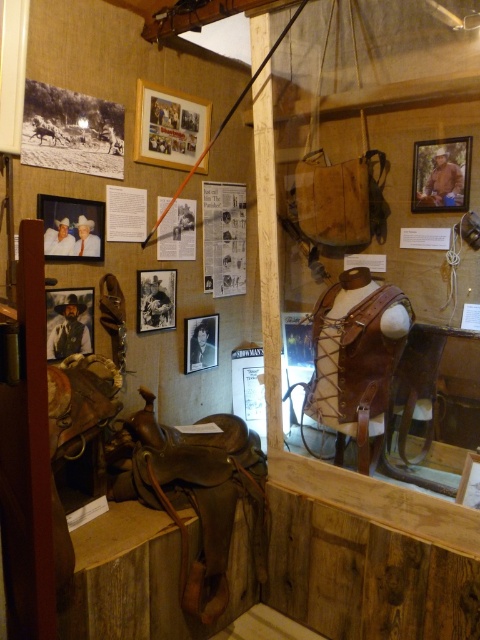
Question: Can you confirm if wooden framed portrait at upper right is positioned below matte wooden picture frame at upper left?

Choices:
 (A) yes
 (B) no

Answer: (B)

Question: Which object is farther from the camera taking this photo?

Choices:
 (A) black matte photo frame at center
 (B) matte black photo frame at center
 (C) matte black picture frame at left
 (D) matte wooden picture frame at upper left

Answer: (B)

Question: Is matte black picture frame at left behind matte black photo frame at center?

Choices:
 (A) yes
 (B) no

Answer: (B)

Question: Which of these objects is positioned farthest from the wooden framed portrait at upper right?

Choices:
 (A) matte black picture frame at left
 (B) matte wooden picture frame at upper left
 (C) wooden frame at upper center
 (D) matte black photo frame at center

Answer: (A)

Question: Among these objects, which one is nearest to the camera?

Choices:
 (A) wooden picture frame at center
 (B) wooden framed portrait at upper right
 (C) matte wooden picture frame at upper left
 (D) matte black picture frame at left

Answer: (A)

Question: Is matte wooden picture frame at upper left closer to the viewer compared to matte black photo frame at center?

Choices:
 (A) yes
 (B) no

Answer: (A)